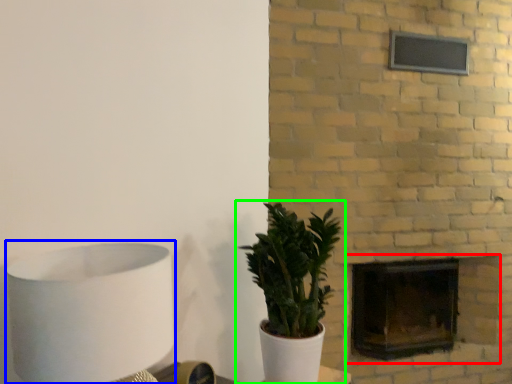
Question: Which is nearer to the fireplace (highlighted by a red box)? table lamp (highlighted by a blue box) or houseplant (highlighted by a green box).

Choices:
 (A) table lamp
 (B) houseplant

Answer: (B)